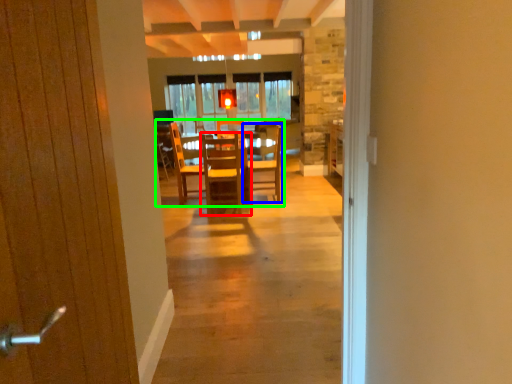
Question: Which object is the closest to the chair (highlighted by a red box)? Choose among these: chair (highlighted by a blue box) or kitchen & dining room table (highlighted by a green box).

Choices:
 (A) chair
 (B) kitchen & dining room table

Answer: (B)